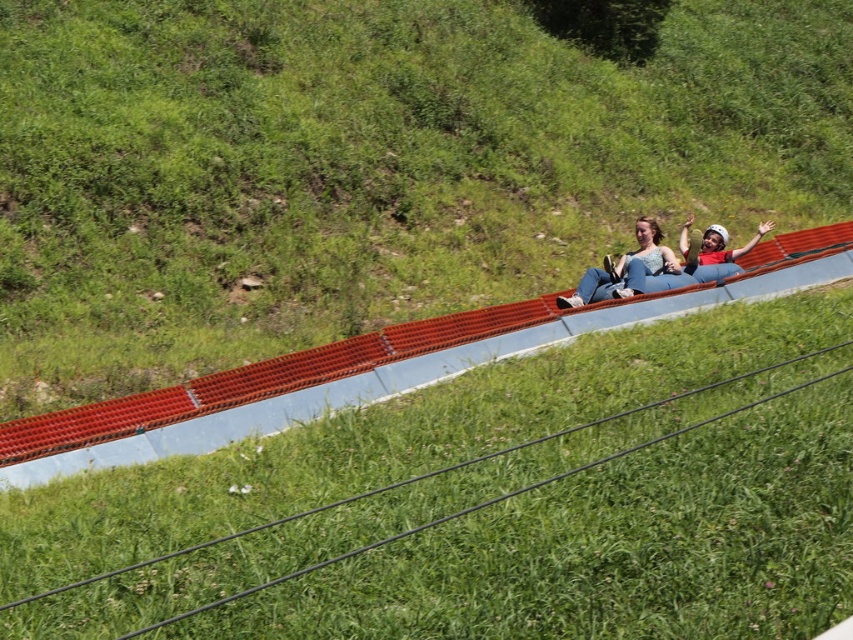
Question: Which of the following is the farthest from the observer?

Choices:
 (A) matte blue helmet at center
 (B) red plastic rail at center
 (C) matte blue tube at center

Answer: (A)

Question: Which of the following is the closest to the observer?

Choices:
 (A) red plastic rail at center
 (B) matte blue tube at center

Answer: (A)

Question: Among these points, which one is farthest from the camera?

Choices:
 (A) (695, 252)
 (B) (286, 461)
 (C) (608, 259)

Answer: (A)

Question: Considering the relative positions of red plastic rail at center and matte blue helmet at center in the image provided, where is red plastic rail at center located with respect to matte blue helmet at center?

Choices:
 (A) right
 (B) left

Answer: (B)

Question: Can you confirm if red plastic rail at center is positioned to the left of matte blue helmet at center?

Choices:
 (A) no
 (B) yes

Answer: (B)

Question: Is red plastic rail at center thinner than matte blue helmet at center?

Choices:
 (A) yes
 (B) no

Answer: (B)